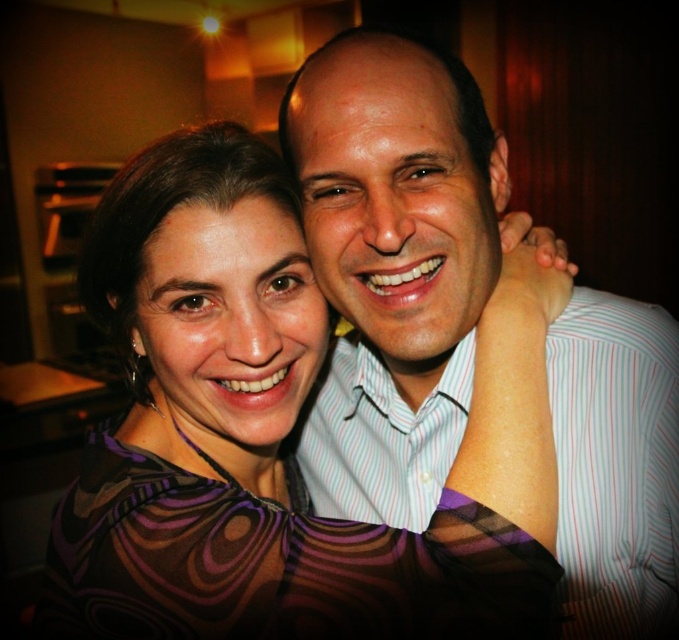
Question: Does patterned fabric dress at center come in front of white striped shirt at center?

Choices:
 (A) yes
 (B) no

Answer: (A)

Question: Which point is farther from the camera taking this photo?

Choices:
 (A) tap(642, 518)
 (B) tap(172, 312)

Answer: (A)

Question: Is patterned fabric dress at center thinner than white striped shirt at center?

Choices:
 (A) yes
 (B) no

Answer: (B)

Question: Is patterned fabric dress at center smaller than white striped shirt at center?

Choices:
 (A) yes
 (B) no

Answer: (B)